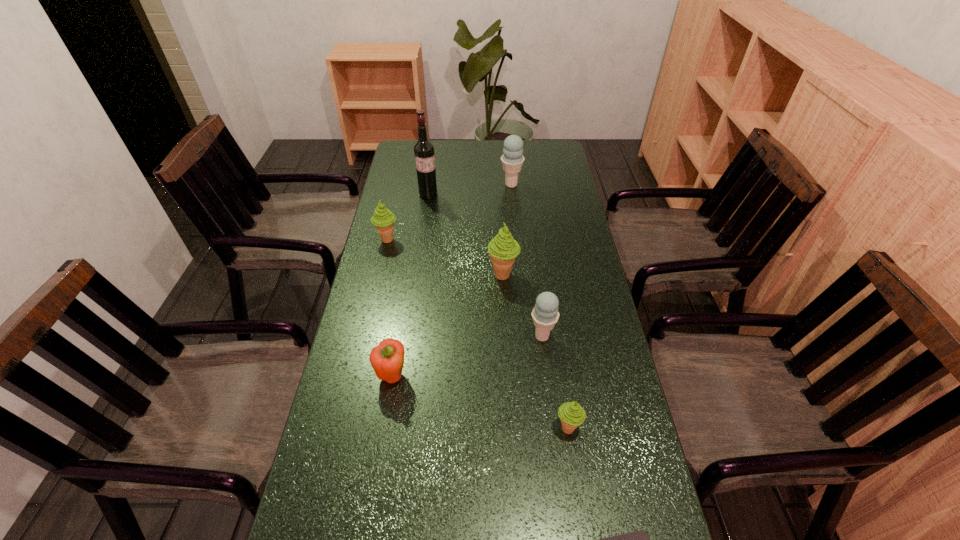
You are a GUI agent. You are given a task and a screenshot of the screen. Output one action in this format:
    pyautogui.click(x=<x>, y=<y>)
    Task: Click on the third nearest object
    
    Given the screenshot: What is the action you would take?
    pyautogui.click(x=387, y=359)

Find the location of a particular element. The image size is (960, 540). the shortest icecream is located at coordinates (571, 414).

This screenshot has width=960, height=540. What are the coordinates of `the rightmost green icecream` in the screenshot? It's located at (571, 414).

At what (x,y) coordinates should I click in order to perform the action: click on free region located on the front and back of the tallest object. Please return your answer as a coordinate pair (x, y). This screenshot has width=960, height=540. Looking at the image, I should click on (417, 272).

At what (x,y) coordinates should I click in order to perform the action: click on vacant point located 0.330m on the left of the farther blue ice cream. Please return your answer as a coordinate pair (x, y). Image resolution: width=960 pixels, height=540 pixels. Looking at the image, I should click on (418, 185).

At what (x,y) coordinates should I click in order to perform the action: click on vacant space located 0.210m on the back of the fifth nearest object. Please return your answer as a coordinate pair (x, y). The image size is (960, 540). Looking at the image, I should click on (500, 224).

In order to click on free spot located 0.070m on the right of the leftmost icecream in this screenshot , I will do `click(420, 240)`.

In order to click on free location located on the back of the fourth nearest object in this screenshot , I will do `click(530, 240)`.

I want to click on vacant space positioned on the back of the third nearest object, so click(x=408, y=275).

I want to click on free point located 0.230m on the left of the nearest green icecream, so click(458, 428).